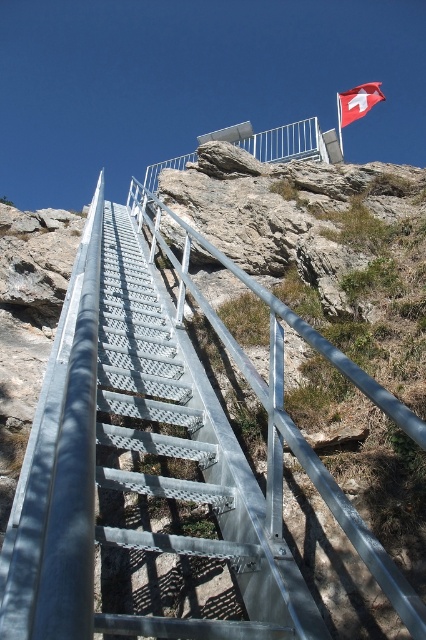
You are standing at the bottom of the staircase and want to reach the Swiss flag on the platform. Which direction should you move relative to the metallic silver rail at upper center to reach the flag?

To reach the Swiss flag on the platform, you should move towards the metallic silver rail at upper center since it is located at the top of the staircase where the flag is displayed.

You are a hiker planning to climb the staircase. You notice the metallic silver rail at upper center and the red fabric flag at upper right. Which object is positioned higher up the staircase?

The red fabric flag at upper right is positioned higher up the staircase than the metallic silver rail at upper center because the metallic silver rail at upper center is below it.

You are standing at the base of the metal staircase looking up. There are two points marked on the staircase. One is at coordinate point [43,451] and the other is at point [345,113]. Which point is closer to you?

Point [43,451] is closer to you than point [345,113].